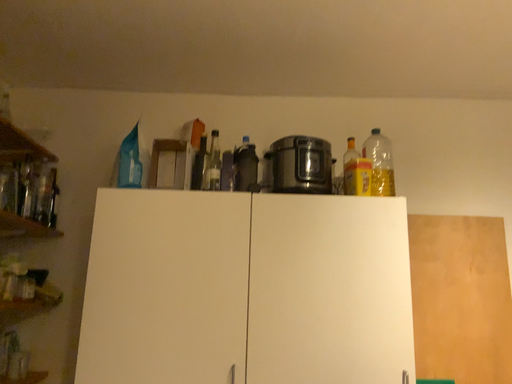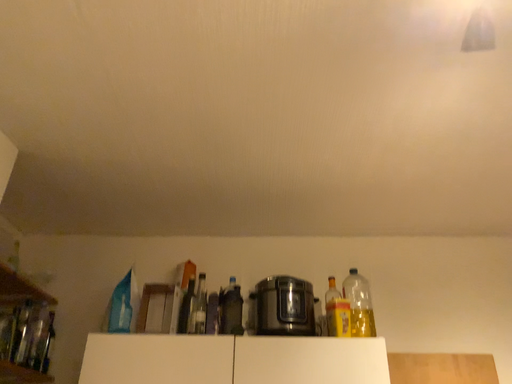
Question: Which way did the camera rotate in the video?

Choices:
 (A) rotated downward
 (B) rotated upward

Answer: (B)